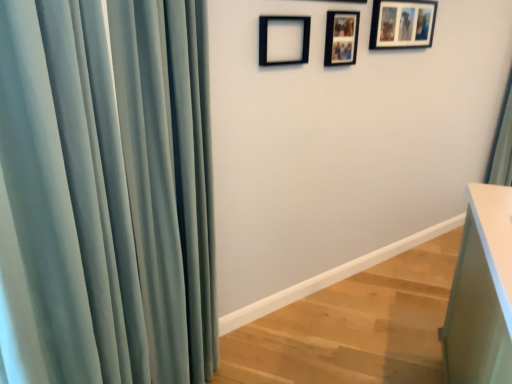
Question: Is white glossy vanity at lower right wider or thinner than matte black picture frame at upper right, which is the first picture frame from right to left?

Choices:
 (A) thin
 (B) wide

Answer: (B)

Question: From their relative heights in the image, would you say white glossy vanity at lower right is taller or shorter than matte black picture frame at upper right, which is the first picture frame from right to left?

Choices:
 (A) tall
 (B) short

Answer: (A)

Question: Which object is positioned closest to the white glossy vanity at lower right?

Choices:
 (A) wooden photo frame at upper center, which is the 2th picture frame from front to back
 (B) matte black picture frame at upper right, the first picture frame in the back-to-front sequence
 (C) satin teal curtain at left
 (D) black matte picture frame at upper center, which ranks as the 3th picture frame in right-to-left order

Answer: (C)

Question: Which object is positioned farthest from the black matte picture frame at upper center, the first picture frame when ordered from left to right?

Choices:
 (A) matte black picture frame at upper right, which is the first picture frame from right to left
 (B) white glossy vanity at lower right
 (C) wooden photo frame at upper center, which is the 2th picture frame from front to back
 (D) satin teal curtain at left

Answer: (B)